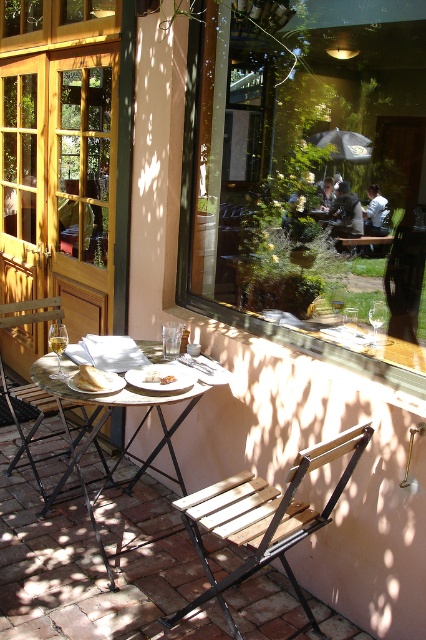
Is white ceramic plate at center wider than white paper napkin at upper left?

Indeed, white ceramic plate at center has a greater width compared to white paper napkin at upper left.

Which is more to the right, white ceramic plate at center or white paper napkin at upper left?

From the viewer's perspective, white paper napkin at upper left appears more on the right side.

Who is more forward, (98, 388) or (144, 378)?

Point (98, 388)

Locate an element on the screen. The height and width of the screenshot is (640, 426). white ceramic plate at center is located at coordinates (100, 388).

Does wooden chair at left have a smaller size compared to white paper napkin at upper left?

Incorrect, wooden chair at left is not smaller in size than white paper napkin at upper left.

Which is in front, point (46, 316) or point (144, 378)?

Positioned in front is point (144, 378).

Image resolution: width=426 pixels, height=640 pixels. What are the coordinates of `wooden chair at left` in the screenshot? It's located at (32, 424).

Can you confirm if wooden frame door at left is shorter than matte black table at center?

In fact, wooden frame door at left may be taller than matte black table at center.

Does wooden frame door at left appear on the left side of matte black table at center?

Yes, wooden frame door at left is to the left of matte black table at center.

Does point (86, 148) come in front of point (193, 400)?

That is False.

You are a GUI agent. You are given a task and a screenshot of the screen. Output one action in this format:
    pyautogui.click(x=<x>, y=<y>)
    Task: Click on the wooden frame door at left
    The image size is (426, 640).
    Given the screenshot: What is the action you would take?
    pyautogui.click(x=58, y=182)